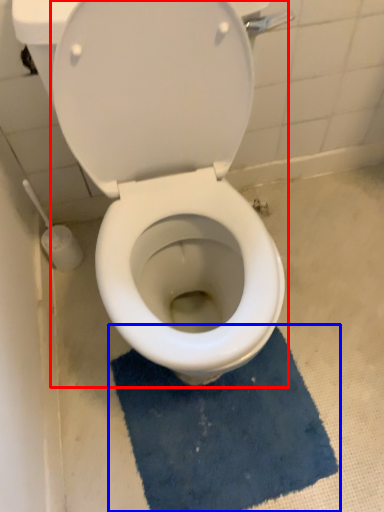
Question: Which object appears closest to the camera in this image, toilet (highlighted by a red box) or bath mat (highlighted by a blue box)?

Choices:
 (A) toilet
 (B) bath mat

Answer: (A)